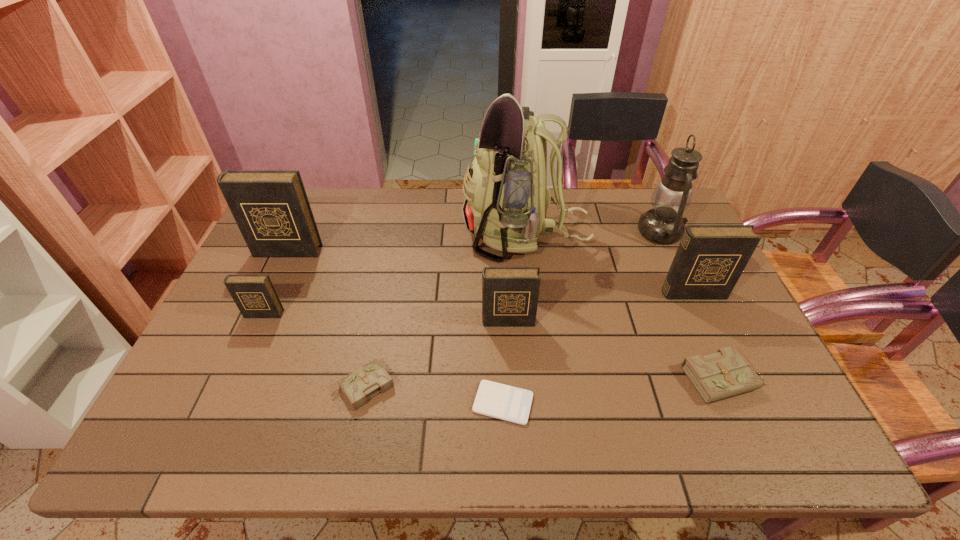
Find the location of `vacant area situated on the front cover of the farthest diary`. vacant area situated on the front cover of the farthest diary is located at coordinates coord(278,269).

Locate an element on the screen. free region located 0.130m on the front cover of the fourth tallest object is located at coordinates (713, 338).

At what (x,y) coordinates should I click in order to perform the action: click on free space located 0.230m on the front cover of the third biggest dark diary. Please return your answer as a coordinate pair (x, y). The image size is (960, 540). Looking at the image, I should click on (513, 407).

You are a GUI agent. You are given a task and a screenshot of the screen. Output one action in this format:
    pyautogui.click(x=<x>, y=<y>)
    Task: Click on the vacant point located on the front cover of the smallest dark diary
    This screenshot has width=960, height=540.
    Given the screenshot: What is the action you would take?
    pyautogui.click(x=223, y=403)

Locate an element on the screen. free region located on the left of the seventh tallest object is located at coordinates (595, 379).

I want to click on vacant region located 0.120m on the left of the fourth diary from right to left, so click(281, 387).

What are the coordinates of `vacant space located on the back of the shortest object` in the screenshot? It's located at (501, 354).

You are a GUI agent. You are given a task and a screenshot of the screen. Output one action in this format:
    pyautogui.click(x=<x>, y=<y>)
    Task: Click on the backpack that is at the far edge
    Image resolution: width=960 pixels, height=540 pixels.
    Given the screenshot: What is the action you would take?
    pyautogui.click(x=506, y=197)

Image resolution: width=960 pixels, height=540 pixels. I want to click on oil lamp that is positioned at the far edge, so click(x=663, y=224).

At what (x,y) coordinates should I click in order to perform the action: click on object at the near edge. Please return your answer as a coordinate pair (x, y). Looking at the image, I should click on (501, 401).